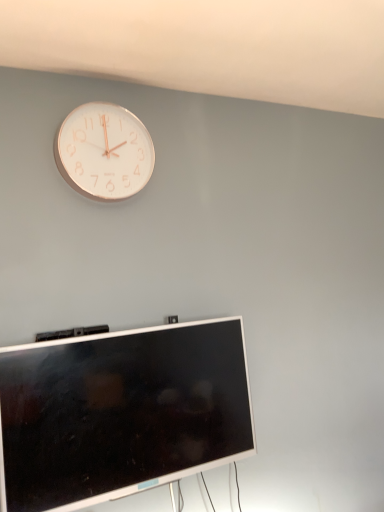
Question: From the image's perspective, is white metallic clock at upper left located above or below silver metallic television at lower center?

Choices:
 (A) above
 (B) below

Answer: (A)

Question: Do you think white metallic clock at upper left is within silver metallic television at lower center, or outside of it?

Choices:
 (A) inside
 (B) outside

Answer: (B)

Question: Is white metallic clock at upper left in front of or behind silver metallic television at lower center in the image?

Choices:
 (A) behind
 (B) front

Answer: (A)

Question: Would you say silver metallic television at lower center is to the left or to the right of white metallic clock at upper left in the picture?

Choices:
 (A) left
 (B) right

Answer: (B)

Question: Does point 76,365 appear closer or farther from the camera than point 127,128?

Choices:
 (A) farther
 (B) closer

Answer: (B)

Question: From their relative heights in the image, would you say silver metallic television at lower center is taller or shorter than white metallic clock at upper left?

Choices:
 (A) tall
 (B) short

Answer: (A)

Question: Considering the positions of silver metallic television at lower center and white metallic clock at upper left in the image, is silver metallic television at lower center wider or thinner than white metallic clock at upper left?

Choices:
 (A) wide
 (B) thin

Answer: (A)